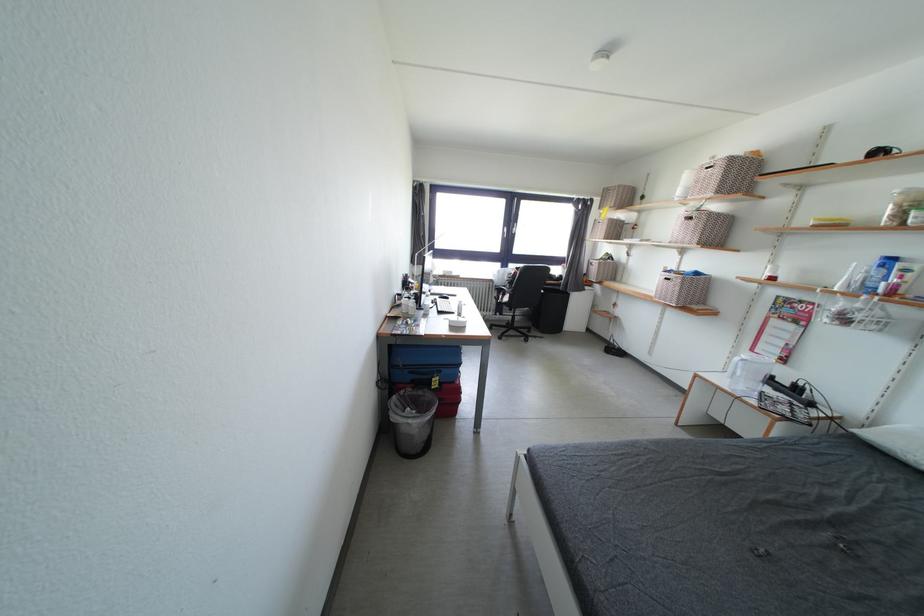
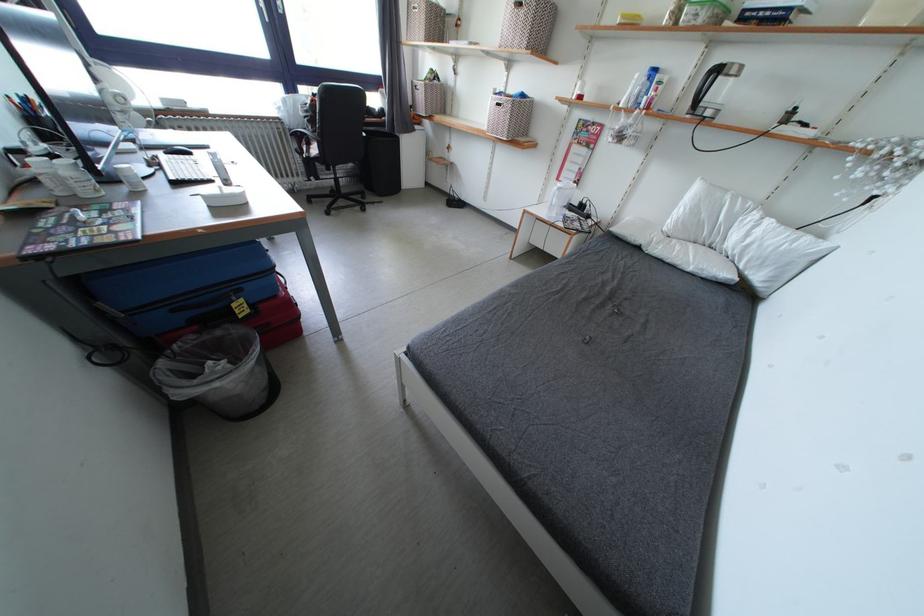
The images are taken continuously from a first-person perspective. In which direction is your viewpoint rotating?

The camera's rotation is toward right-down.